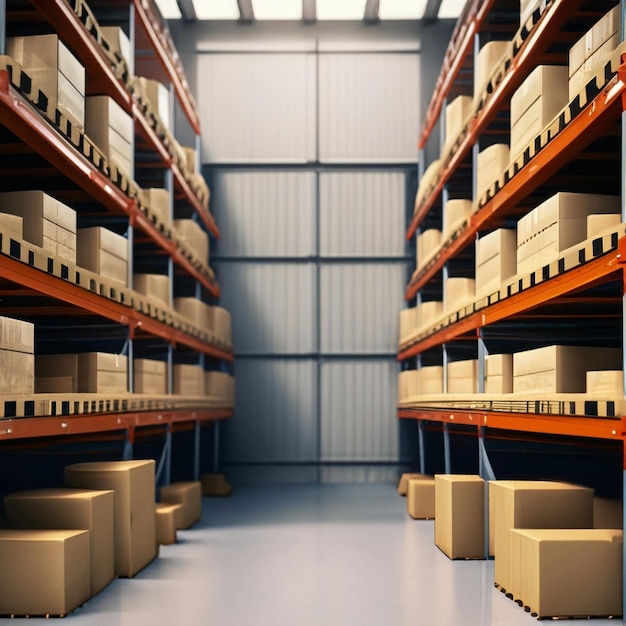
You are a GUI agent. You are given a task and a screenshot of the screen. Output one action in this format:
    pyautogui.click(x=<x>, y=<y>)
    Task: Click on the orange shelf
    The width and height of the screenshot is (626, 626).
    Given the screenshot: What is the action you would take?
    pyautogui.click(x=153, y=418), pyautogui.click(x=148, y=326), pyautogui.click(x=156, y=235), pyautogui.click(x=156, y=141), pyautogui.click(x=192, y=108), pyautogui.click(x=432, y=113), pyautogui.click(x=454, y=146), pyautogui.click(x=489, y=208), pyautogui.click(x=511, y=299), pyautogui.click(x=503, y=421)